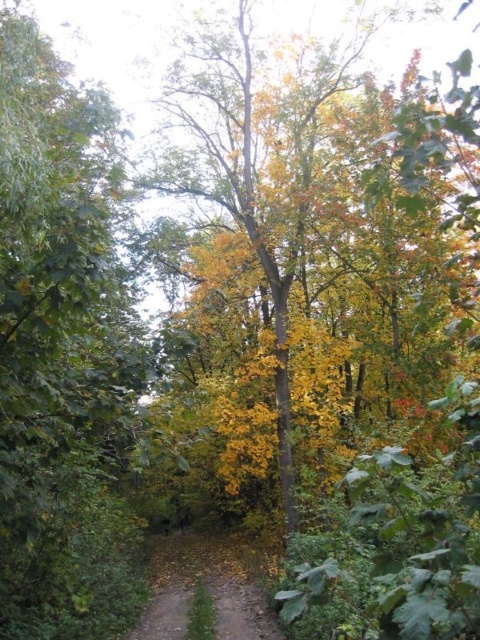
Can you confirm if green leafy tree at left is positioned to the left of brown dirt path at center?

Correct, you'll find green leafy tree at left to the left of brown dirt path at center.

Is point (6, 541) positioned behind point (252, 605)?

No.

Where is `green leafy tree at left`? This screenshot has width=480, height=640. green leafy tree at left is located at coordinates (62, 353).